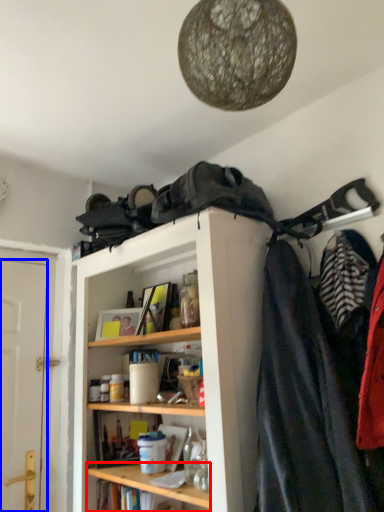
Question: Which object appears closest to the camera in this image, cabinet (highlighted by a red box) or door (highlighted by a blue box)?

Choices:
 (A) cabinet
 (B) door

Answer: (A)